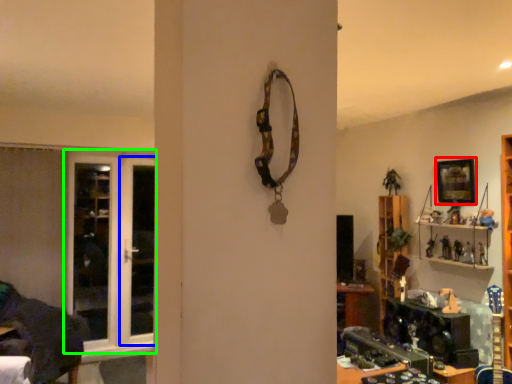
Question: Estimate the real-world distances between objects in this image. Which object is closer to picture frame (highlighted by a red box), screen door (highlighted by a blue box) or door (highlighted by a green box)?

Choices:
 (A) screen door
 (B) door

Answer: (A)